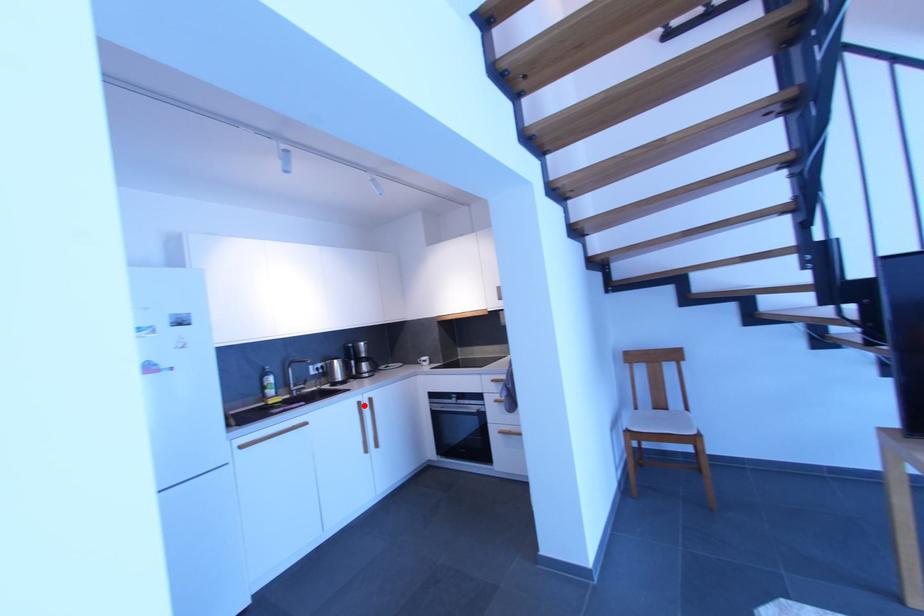
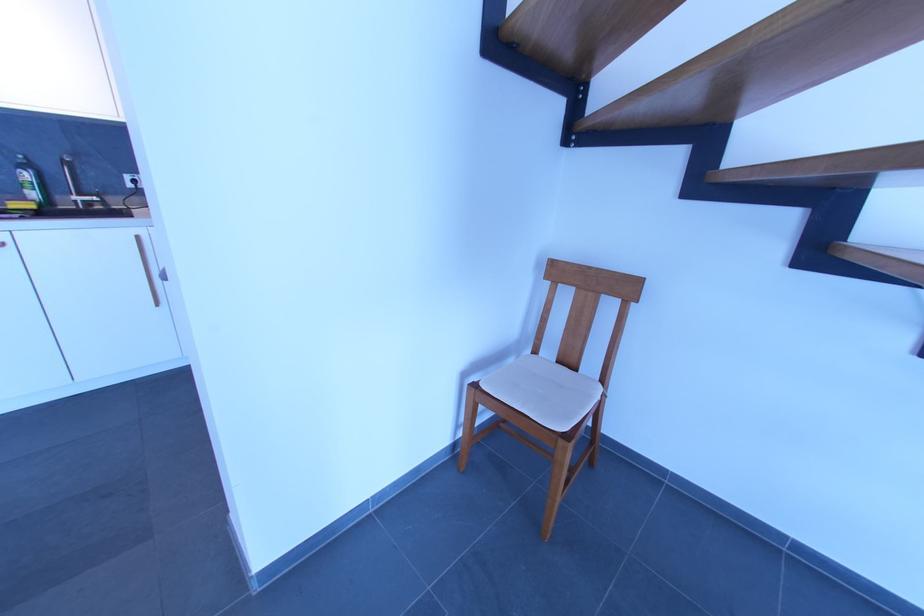
Find the pixel in the second image that matches the highlighted location in the first image.

(142, 241)